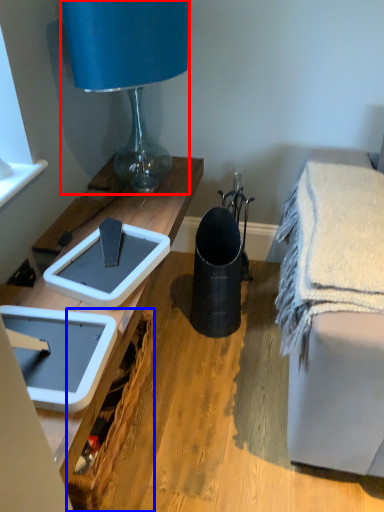
Question: Among these objects, which one is nearest to the camera, lamp (highlighted by a red box) or picnic basket (highlighted by a blue box)?

Choices:
 (A) lamp
 (B) picnic basket

Answer: (B)